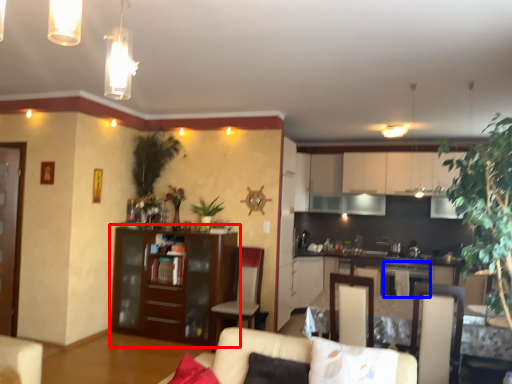
Question: Which object is further to the camera taking this photo, cabinetry (highlighted by a red box) or appliance (highlighted by a blue box)?

Choices:
 (A) cabinetry
 (B) appliance

Answer: (B)